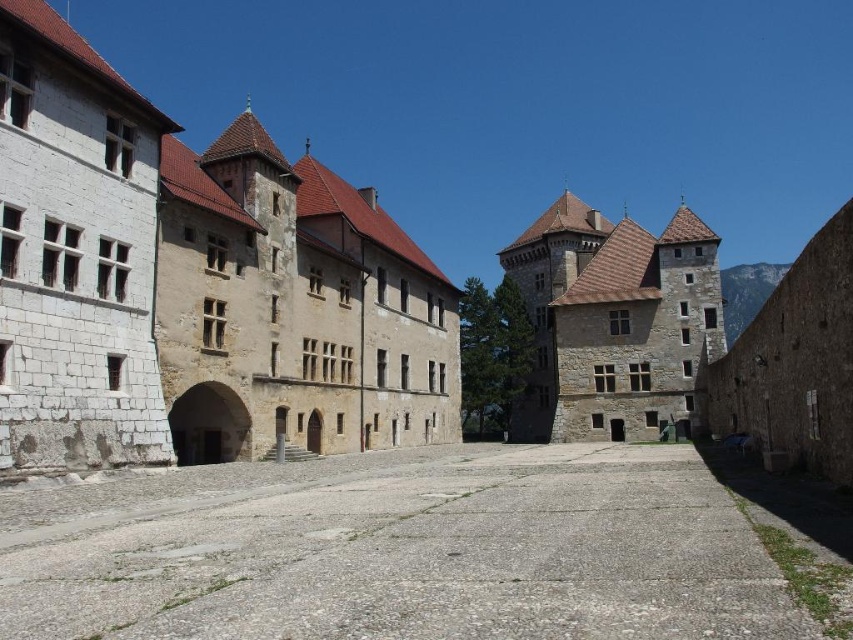
Question: Which point is closer to the camera taking this photo?

Choices:
 (A) (541, 365)
 (B) (148, 406)
 (C) (502, 509)

Answer: (C)

Question: Is white stone building at center closer to camera compared to gray concrete alley at center?

Choices:
 (A) yes
 (B) no

Answer: (B)

Question: Which of the following is the closest to the observer?

Choices:
 (A) (323, 182)
 (B) (668, 264)

Answer: (A)

Question: Considering the real-world distances, which object is closest to the white stone building at center?

Choices:
 (A) gray concrete alley at center
 (B) brown stone castle at center

Answer: (A)

Question: Where is white stone building at center located in relation to gray concrete alley at center in the image?

Choices:
 (A) below
 (B) above

Answer: (B)

Question: Does white stone building at center lie in front of brown stone castle at center?

Choices:
 (A) no
 (B) yes

Answer: (B)